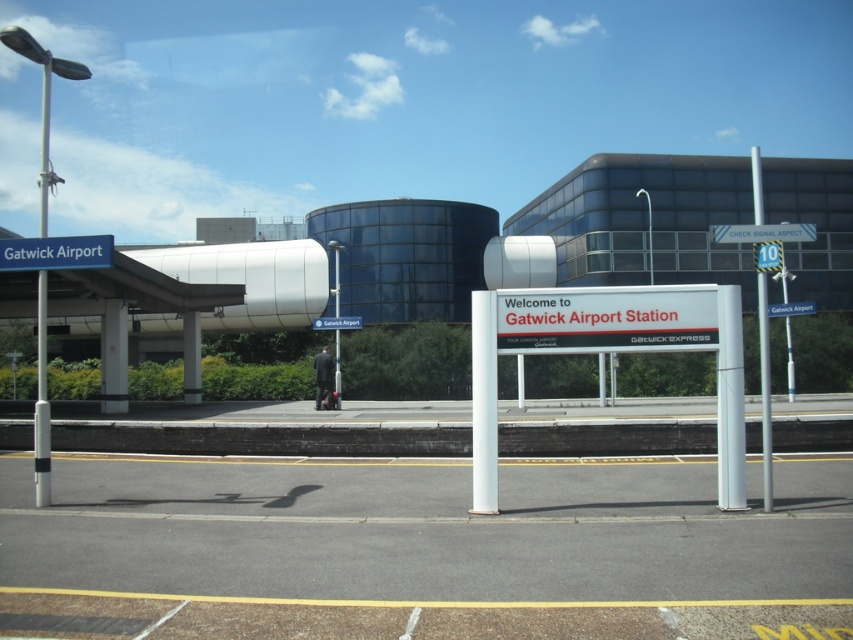
You are a traveler at Gatwick Airport Station. You need to locate the blue metallic sign at upper center. Where should you look relative to the white glossy pillar at center?

The blue metallic sign at upper center is to the right of the white glossy pillar at center.

You are a maintenance worker at Gatwick Airport Station and need to reach both the white plastic sign at upper right and the blue metallic sign at upper center. If your ladder can extend up to 30 feet, will you be able to reach both signs from the same spot?

The white plastic sign at upper right is 34.36 feet from the blue metallic sign at upper center. Since your ladder can only extend up to 30 feet, you won not be able to reach both signs from the same spot as the distance between them exceeds the ladder length.